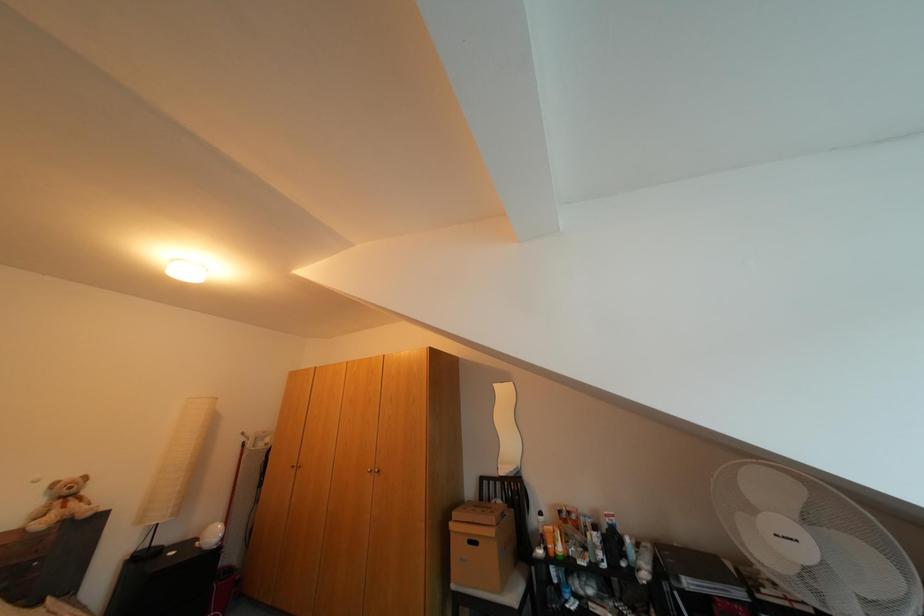
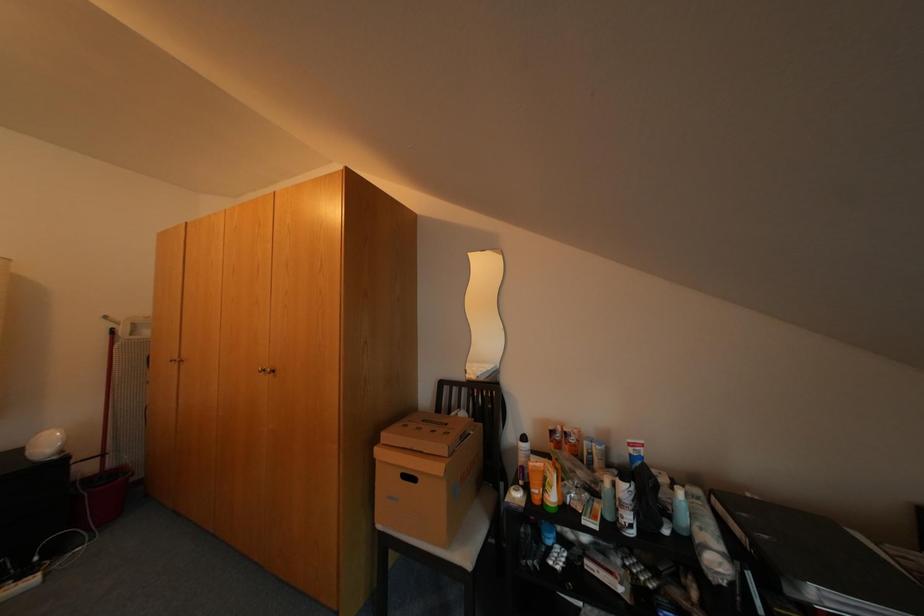
Question: Which direction would the cameraman need to move to produce the second image? Reply with the corresponding letter.

Choices:
 (A) Left
 (B) Right
 (C) Forward
 (D) Backward

Answer: (C)